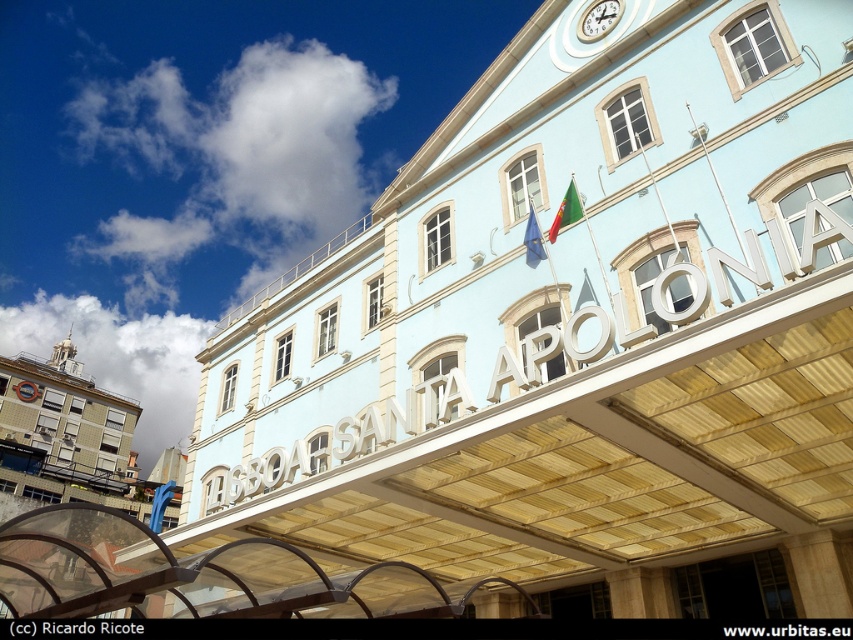
You are an architect analyzing the building exterior. Which object between the brick building at lower left and the green fabric flag at upper center occupies more visual space in the image?

The brick building at lower left is larger in size than the green fabric flag at upper center, so it occupies more visual space in the image.

In the scene shown: You are a visitor at the LISBOA SANTA APOLONIA building and want to know which object is shorter between the white glossy clock at upper center and the european union flag at center. Can you tell me?

The white glossy clock at upper center is not as tall as the european union flag at center, so the white glossy clock at upper center is shorter.

You are an architect analyzing the building facade. Based on the image, which object occupies more space in the scene between the brick building at lower left and the white glossy clock at upper center?

The brick building at lower left occupies more space in the scene as it has a larger size compared to the white glossy clock at upper center.